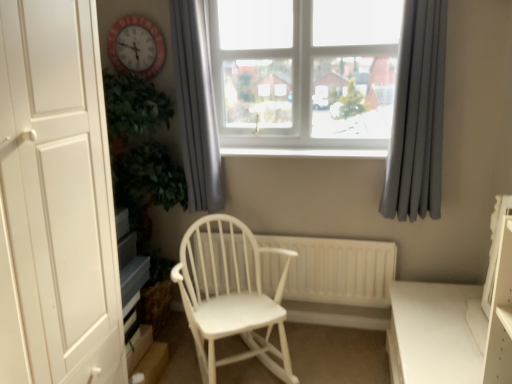
Question: From a real-world perspective, is red plastic clock at upper left beneath gray fabric curtain at upper right, arranged as the 2th curtain when viewed from the left?

Choices:
 (A) yes
 (B) no

Answer: (B)

Question: Is red plastic clock at upper left outside of gray fabric curtain at upper right, which is the first curtain from right to left?

Choices:
 (A) no
 (B) yes

Answer: (B)

Question: Is gray fabric curtain at upper right, arranged as the 2th curtain when viewed from the left, completely or partially inside red plastic clock at upper left?

Choices:
 (A) yes
 (B) no

Answer: (B)

Question: Is the position of red plastic clock at upper left more distant than that of gray fabric curtain at upper right, arranged as the 2th curtain when viewed from the left?

Choices:
 (A) no
 (B) yes

Answer: (B)

Question: Is red plastic clock at upper left looking in the opposite direction of gray fabric curtain at upper right, arranged as the 2th curtain when viewed from the left?

Choices:
 (A) yes
 (B) no

Answer: (B)

Question: Considering the relative positions of red plastic clock at upper left and gray fabric curtain at upper right, which is the first curtain from right to left, in the image provided, is red plastic clock at upper left to the left of gray fabric curtain at upper right, which is the first curtain from right to left, from the viewer's perspective?

Choices:
 (A) no
 (B) yes

Answer: (B)

Question: From the image's perspective, is white matte door at left located above gray fabric curtain at upper center, marked as the second curtain in a right-to-left arrangement?

Choices:
 (A) no
 (B) yes

Answer: (A)

Question: Considering the relative sizes of white matte door at left and gray fabric curtain at upper center, marked as the second curtain in a right-to-left arrangement, in the image provided, is white matte door at left shorter than gray fabric curtain at upper center, marked as the second curtain in a right-to-left arrangement,?

Choices:
 (A) yes
 (B) no

Answer: (B)

Question: Considering the relative sizes of white matte door at left and gray fabric curtain at upper center, which appears as the first curtain when viewed from the left, in the image provided, is white matte door at left thinner than gray fabric curtain at upper center, which appears as the first curtain when viewed from the left,?

Choices:
 (A) yes
 (B) no

Answer: (B)

Question: Considering the relative sizes of white matte door at left and gray fabric curtain at upper center, marked as the second curtain in a right-to-left arrangement, in the image provided, is white matte door at left smaller than gray fabric curtain at upper center, marked as the second curtain in a right-to-left arrangement,?

Choices:
 (A) no
 (B) yes

Answer: (A)

Question: Can we say white matte door at left lies outside gray fabric curtain at upper center, which appears as the first curtain when viewed from the left?

Choices:
 (A) no
 (B) yes

Answer: (B)

Question: Considering the relative positions of white matte door at left and gray fabric curtain at upper center, marked as the second curtain in a right-to-left arrangement, in the image provided, is white matte door at left to the right of gray fabric curtain at upper center, marked as the second curtain in a right-to-left arrangement, from the viewer's perspective?

Choices:
 (A) yes
 (B) no

Answer: (B)

Question: Considering the relative sizes of gray fabric curtain at upper right, which is the first curtain from right to left, and white plastic window at upper center in the image provided, is gray fabric curtain at upper right, which is the first curtain from right to left, smaller than white plastic window at upper center?

Choices:
 (A) yes
 (B) no

Answer: (A)